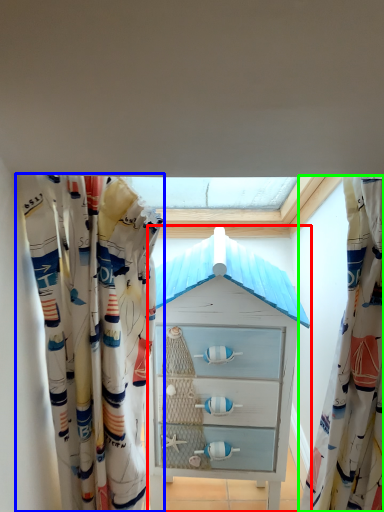
Question: Based on their relative distances, which object is farther from chest of drawers (highlighted by a red box)? Choose from curtain (highlighted by a blue box) and curtain (highlighted by a green box).

Choices:
 (A) curtain
 (B) curtain

Answer: (B)